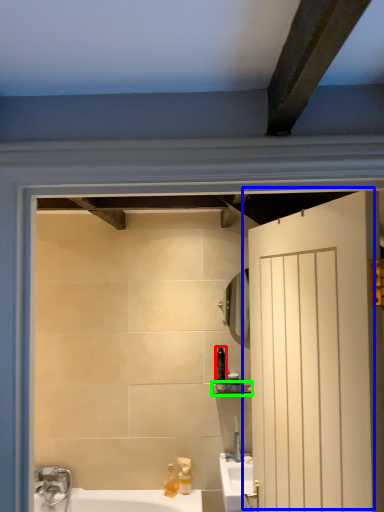
Question: Which object is positioned closest to toiletry (highlighted by a red box)? Select from door (highlighted by a blue box) and balustrade (highlighted by a green box).

Choices:
 (A) door
 (B) balustrade

Answer: (B)